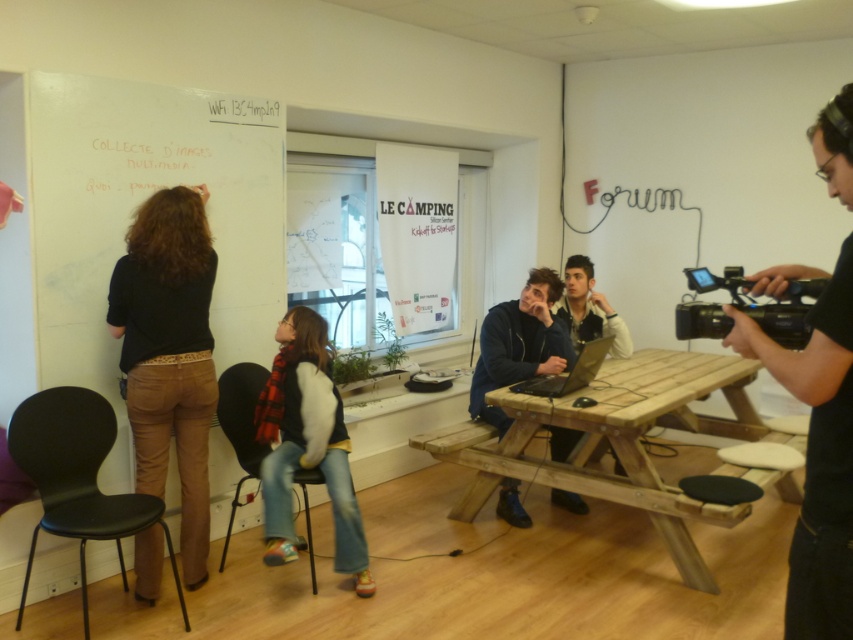
You are organizing a meeting in the room and need to place a new object between the light brown leather jacket at center and the silver metallic laptop at center. Is there enough space to place it?

The light brown leather jacket at center is to the right of the silver metallic laptop at center, so there is space between them to place a new object.